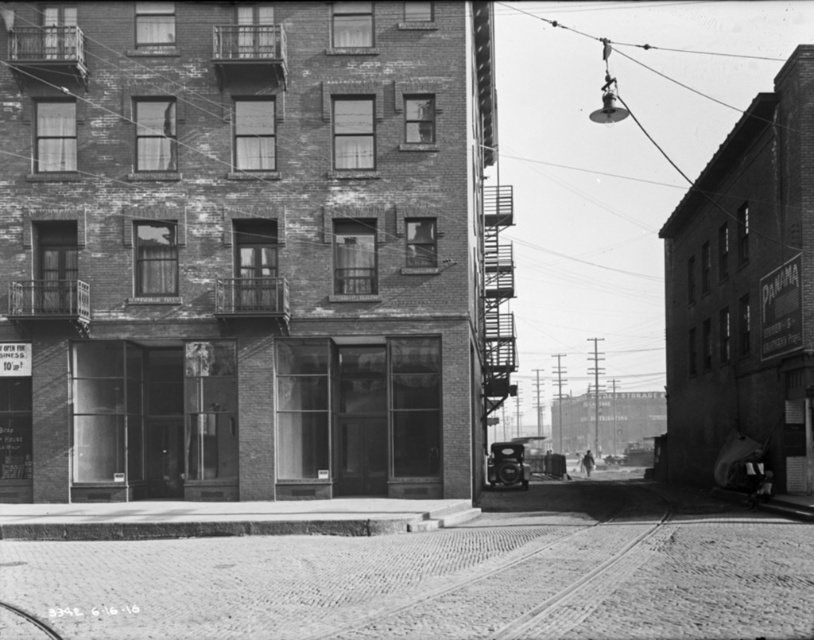
Question: Observing the image, what is the correct spatial positioning of metallic car at center in reference to dark gray fabric man at center?

Choices:
 (A) right
 (B) left

Answer: (B)

Question: Which object is positioned closest to the metallic car at center?

Choices:
 (A) dark gray fabric jacket at lower right
 (B) dark gray fabric man at center

Answer: (A)

Question: Which point appears closest to the camera in this image?

Choices:
 (A) [497, 458]
 (B) [755, 461]
 (C) [585, 470]

Answer: (B)

Question: Is metallic car at center wider than dark gray fabric jacket at lower right?

Choices:
 (A) yes
 (B) no

Answer: (A)

Question: Is metallic car at center smaller than dark gray fabric man at center?

Choices:
 (A) no
 (B) yes

Answer: (B)

Question: Which point is closer to the camera taking this photo?

Choices:
 (A) (756, 454)
 (B) (593, 460)

Answer: (A)